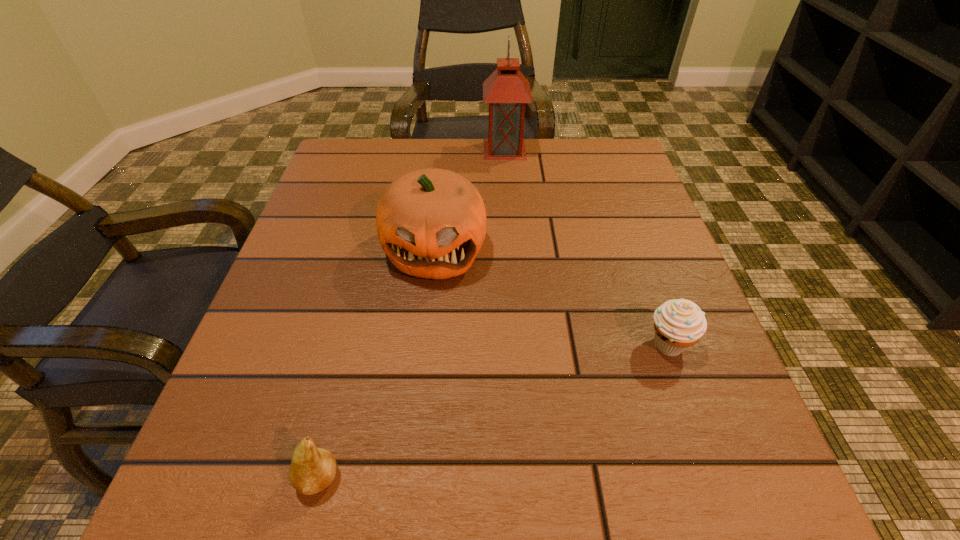
In the image, there is a desktop. Where is `vacant space at the near left corner`? The height and width of the screenshot is (540, 960). vacant space at the near left corner is located at coordinates (194, 500).

Find the location of a particular element. The image size is (960, 540). vacant space at the far right corner of the desktop is located at coordinates (583, 158).

In the image, there is a desktop. Identify the location of vacant space at the near right corner. The height and width of the screenshot is (540, 960). (684, 492).

The image size is (960, 540). What are the coordinates of `free spot between the pear and the tallest object` in the screenshot? It's located at (412, 314).

At what (x,y) coordinates should I click in order to perform the action: click on free point between the muffin and the nearest object. Please return your answer as a coordinate pair (x, y). Image resolution: width=960 pixels, height=540 pixels. Looking at the image, I should click on (493, 411).

I want to click on free space between the rightmost object and the third shortest object, so click(551, 298).

Where is `unoccupied area between the tallest object and the muffin`? This screenshot has width=960, height=540. unoccupied area between the tallest object and the muffin is located at coordinates pyautogui.click(x=587, y=247).

At what (x,y) coordinates should I click in order to perform the action: click on vacant area that lies between the second tallest object and the nearest object. Please return your answer as a coordinate pair (x, y). Looking at the image, I should click on (376, 364).

Locate an element on the screen. unoccupied position between the pear and the third farthest object is located at coordinates (493, 411).

Locate an element on the screen. The height and width of the screenshot is (540, 960). empty space between the third shortest object and the nearest object is located at coordinates (376, 364).